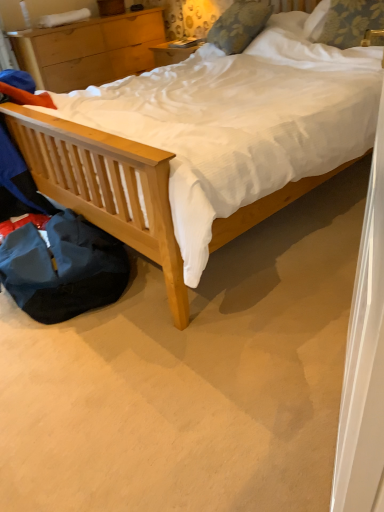
Question: Could you tell me if floral fabric pillow at upper center, the second pillow when ordered from right to left, is turned towards light wood nightstand at upper left?

Choices:
 (A) no
 (B) yes

Answer: (A)

Question: Is floral fabric pillow at upper center, the second pillow when ordered from right to left, bigger than light wood nightstand at upper left?

Choices:
 (A) no
 (B) yes

Answer: (A)

Question: Is floral fabric pillow at upper center, the second pillow when ordered from right to left, next to light wood nightstand at upper left?

Choices:
 (A) yes
 (B) no

Answer: (B)

Question: From the image's perspective, is floral fabric pillow at upper center, the second pillow when ordered from right to left, below light wood nightstand at upper left?

Choices:
 (A) yes
 (B) no

Answer: (A)

Question: Considering the relative sizes of floral fabric pillow at upper center, marked as the first pillow in a left-to-right arrangement, and light wood nightstand at upper left in the image provided, is floral fabric pillow at upper center, marked as the first pillow in a left-to-right arrangement, wider than light wood nightstand at upper left?

Choices:
 (A) no
 (B) yes

Answer: (A)

Question: From a real-world perspective, is floral fabric pillow at upper center, the second pillow when ordered from right to left, on light wood nightstand at upper left?

Choices:
 (A) no
 (B) yes

Answer: (B)

Question: Does floral fabric pillow at upper right, positioned as the first pillow in right-to-left order, have a lesser width compared to floral fabric pillow at upper center, marked as the first pillow in a left-to-right arrangement?

Choices:
 (A) no
 (B) yes

Answer: (B)

Question: Considering the relative positions of floral fabric pillow at upper right, arranged as the 2th pillow when viewed from the left, and floral fabric pillow at upper center, the second pillow when ordered from right to left, in the image provided, is floral fabric pillow at upper right, arranged as the 2th pillow when viewed from the left, behind floral fabric pillow at upper center, the second pillow when ordered from right to left,?

Choices:
 (A) no
 (B) yes

Answer: (A)

Question: Does floral fabric pillow at upper right, arranged as the 2th pillow when viewed from the left, have a greater height compared to floral fabric pillow at upper center, marked as the first pillow in a left-to-right arrangement?

Choices:
 (A) yes
 (B) no

Answer: (B)

Question: Considering the relative positions of floral fabric pillow at upper right, positioned as the first pillow in right-to-left order, and floral fabric pillow at upper center, the second pillow when ordered from right to left, in the image provided, is floral fabric pillow at upper right, positioned as the first pillow in right-to-left order, to the right of floral fabric pillow at upper center, the second pillow when ordered from right to left, from the viewer's perspective?

Choices:
 (A) no
 (B) yes

Answer: (B)

Question: Is floral fabric pillow at upper right, arranged as the 2th pillow when viewed from the left, oriented towards floral fabric pillow at upper center, marked as the first pillow in a left-to-right arrangement?

Choices:
 (A) yes
 (B) no

Answer: (B)

Question: From a real-world perspective, is floral fabric pillow at upper right, positioned as the first pillow in right-to-left order, under floral fabric pillow at upper center, marked as the first pillow in a left-to-right arrangement?

Choices:
 (A) yes
 (B) no

Answer: (A)

Question: Does light wood nightstand at upper left have a larger size compared to floral fabric pillow at upper right, arranged as the 2th pillow when viewed from the left?

Choices:
 (A) yes
 (B) no

Answer: (A)